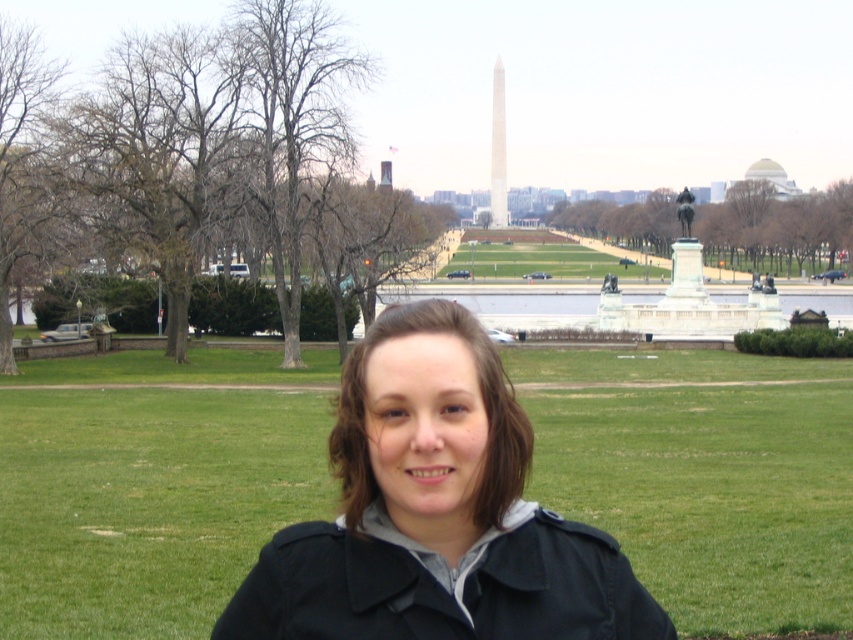
Where is the black matte jacket at center located in the image?

The black matte jacket at center is located at point (x=436, y=513) in the image.

You are a photographer trying to capture a photo of the bronze statue at center without the black matte jacket at center blocking the view. Based on their positions, is it possible to take such a photo from your current position?

The black matte jacket at center is below bronze statue at center, so the bronze statue at center is positioned higher up. Since the jacket is below the statue, you can likely take a photo of the bronze statue at center without the jacket blocking the view by angling the camera upwards or moving to a higher vantage point.